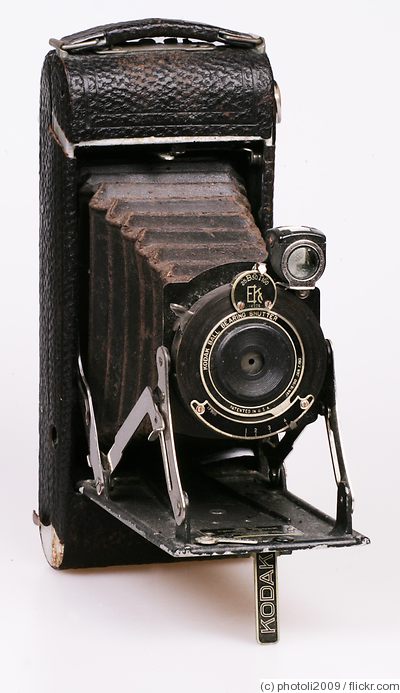
Identify the location of handle. Image resolution: width=400 pixels, height=693 pixels. [x=162, y=24].